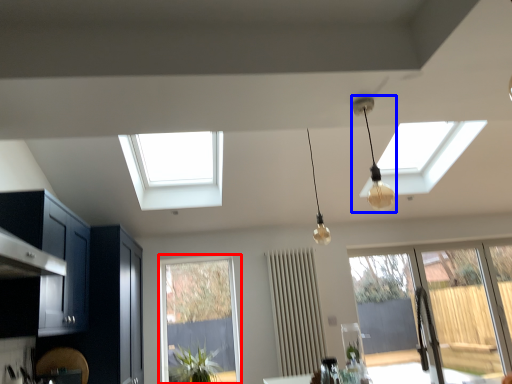
Question: Which of the following is the farthest to the observer, window (highlighted by a red box) or lamp (highlighted by a blue box)?

Choices:
 (A) window
 (B) lamp

Answer: (A)